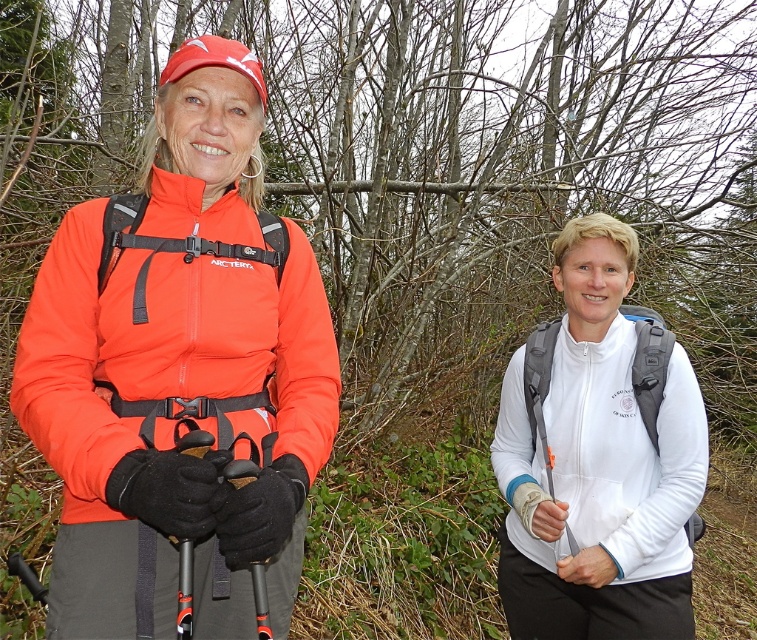
Which is more to the right, white matte jacket at right or black rubber ski pole at center?

Positioned to the right is white matte jacket at right.

What do you see at coordinates (625, 451) in the screenshot? The height and width of the screenshot is (640, 757). I see `white matte jacket at right` at bounding box center [625, 451].

Identify the location of white matte jacket at right. (625, 451).

Where is `white matte jacket at right`? The height and width of the screenshot is (640, 757). white matte jacket at right is located at coordinates (625, 451).

Is matte orange jacket at left smaller than white matte jacket at right?

Yes.

The width and height of the screenshot is (757, 640). What do you see at coordinates (167, 352) in the screenshot?
I see `matte orange jacket at left` at bounding box center [167, 352].

The width and height of the screenshot is (757, 640). Identify the location of matte orange jacket at left. (167, 352).

Which is above, matte orange jacket at left or black rubber ski pole at center?

matte orange jacket at left

Between point (329, 392) and point (195, 442), which one is positioned behind?

The point (329, 392) is behind.

This screenshot has width=757, height=640. What are the coordinates of `matte orange jacket at left` in the screenshot? It's located at (167, 352).